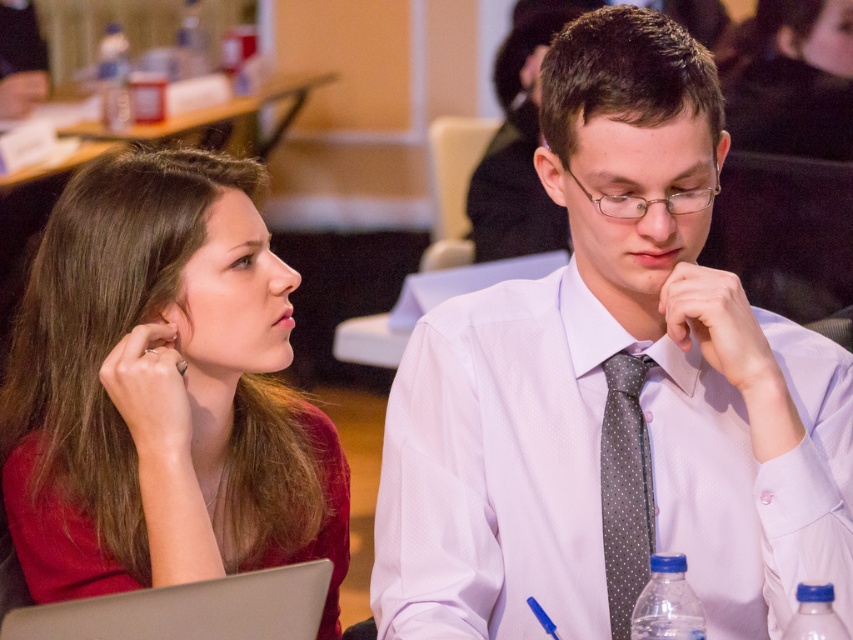
You are organizing a conference and need to place a 18 inch wide decorative plate between the white dotted tie at center and the silver metallic laptop at lower left. Can the plate fit in the space between them?

The distance between the white dotted tie at center and the silver metallic laptop at lower left is 17.21 inches. Since the plate is 18 inches wide, it cannot fit in the space between them as the plate is wider than the available distance.

Where is the white dotted tie at center located in the image?

The white dotted tie at center is located at point 0.611 on the x axis and 0.721 on the y axis.

You are a photographer at the event and need to capture a clear shot of both the white dotted tie at center and the gray dotted tie at center. Since the camera can only focus on one tie at a time, which one should you focus on to ensure it appears sharp in the photo?

The white dotted tie at center is positioned over the gray dotted tie at center, so focusing on the white dotted tie at center will ensure it appears sharp while the gray dotted tie at center may appear slightly out of focus due to its position behind.